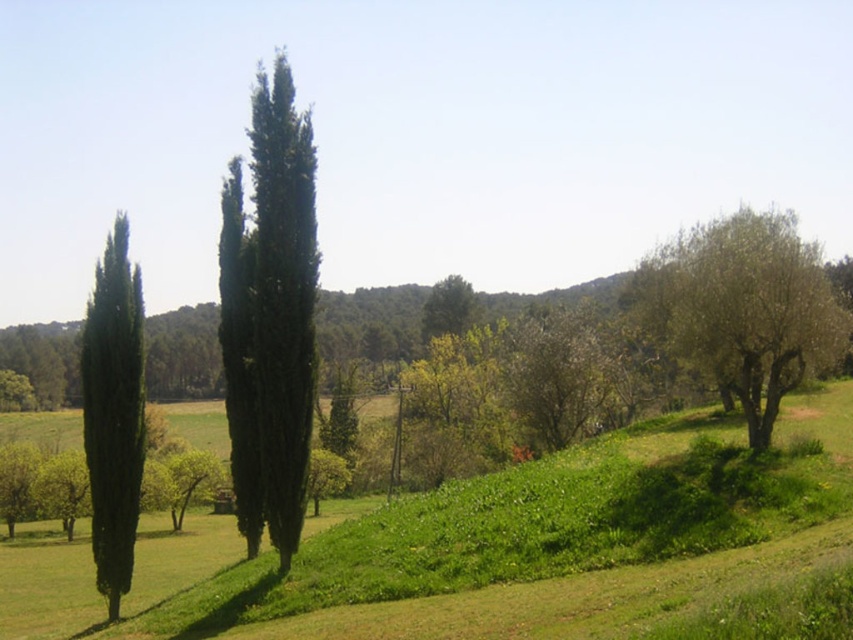
You are a bird looking for a place to perch. You see the green leafy tree at right and the green matte cypress at left. Which tree is higher up in the scene?

The green leafy tree at right is located above the green matte cypress at left, so it is higher up in the scene.

Looking at this image, you are a hiker planning to set up a tent for the night. You have two options for camping spots near the green grassy hillside at center and the green leafy tree at right. Based on their sizes, which location might offer more space for your tent?

The green grassy hillside at center is larger in size than the green leafy tree at right, so setting up the tent near the green grassy hillside at center would provide more space.